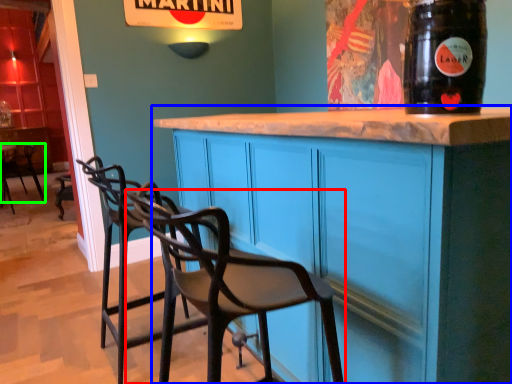
Question: Which is nearer to the chair (highlighted by a red box)? cabinetry (highlighted by a blue box) or chair (highlighted by a green box).

Choices:
 (A) cabinetry
 (B) chair

Answer: (A)